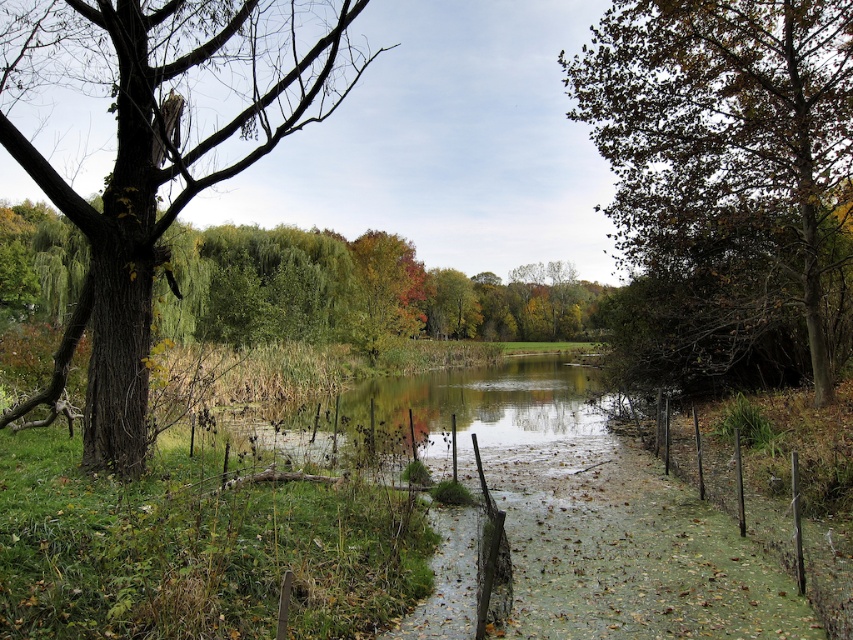
You are standing in the middle of the grassy area between the brown rough bark tree at left and the brown leafy tree at right. Which tree is closer to your right side?

The brown leafy tree at right is closer to your right side because it is positioned to the right of the brown rough bark tree at left.